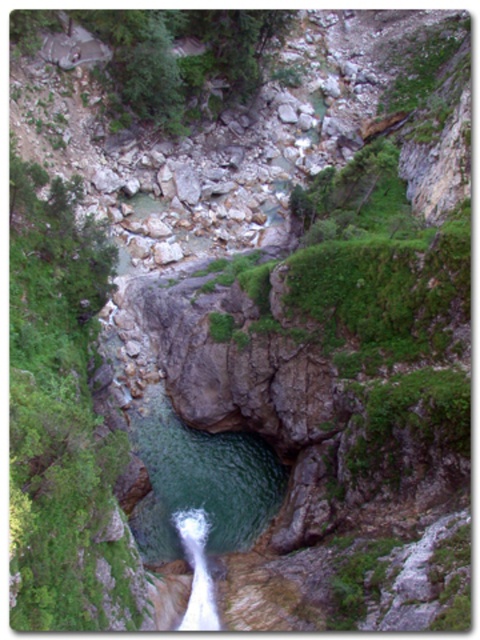
Consider the image. Does green mossy rock at left have a smaller size compared to white frothy water at center?

Actually, green mossy rock at left might be larger than white frothy water at center.

This screenshot has width=480, height=640. What do you see at coordinates (60, 417) in the screenshot?
I see `green mossy rock at left` at bounding box center [60, 417].

Identify the location of green mossy rock at left. (60, 417).